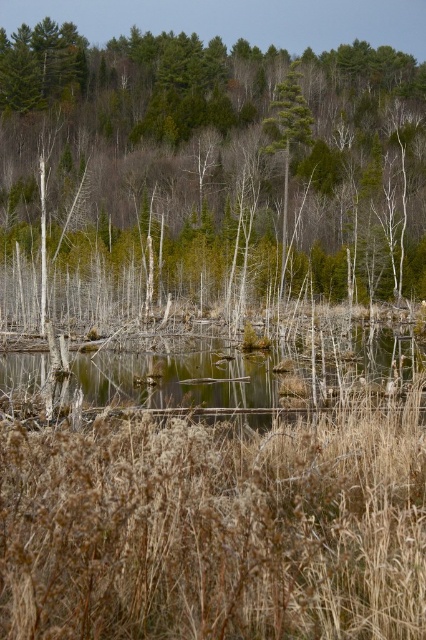
Question: Can you confirm if brown dry grass at center is thinner than green leafy tree at center?

Choices:
 (A) yes
 (B) no

Answer: (A)

Question: Is brown dry grass at center positioned behind clear water at center?

Choices:
 (A) no
 (B) yes

Answer: (A)

Question: Considering the real-world distances, which object is farthest from the brown wood tree at center?

Choices:
 (A) brown dry grass at center
 (B) clear water at center
 (C) green leafy tree at center

Answer: (A)

Question: Which point is farther to the camera?

Choices:
 (A) clear water at center
 (B) brown wood tree at center

Answer: (B)

Question: Is brown wood tree at center behind brown dry grass at center?

Choices:
 (A) no
 (B) yes

Answer: (B)

Question: Based on their relative distances, which object is farther from the clear water at center?

Choices:
 (A) brown dry grass at center
 (B) brown wood tree at center
 (C) green leafy tree at center

Answer: (B)